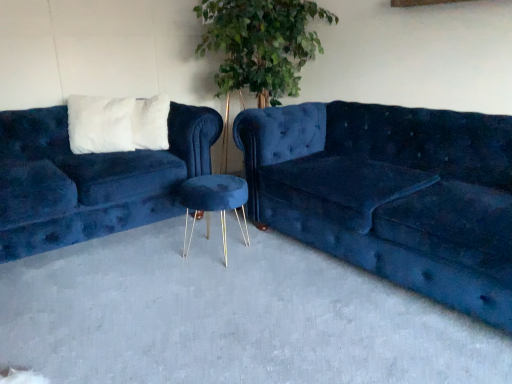
At what (x,y) coordinates should I click in order to perform the action: click on free point to the left of velvet blue stool at center. Please return your answer as a coordinate pair (x, y). Looking at the image, I should click on (155, 249).